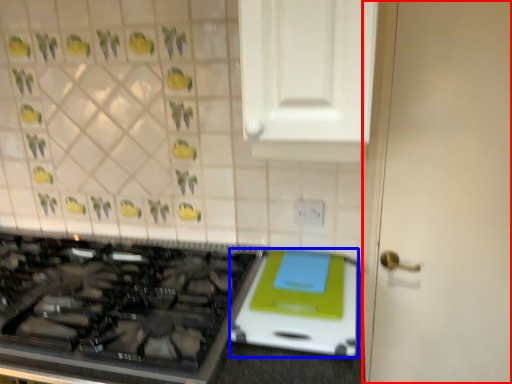
Question: Which object is closer to the camera taking this photo, door (highlighted by a red box) or appliance (highlighted by a blue box)?

Choices:
 (A) door
 (B) appliance

Answer: (B)